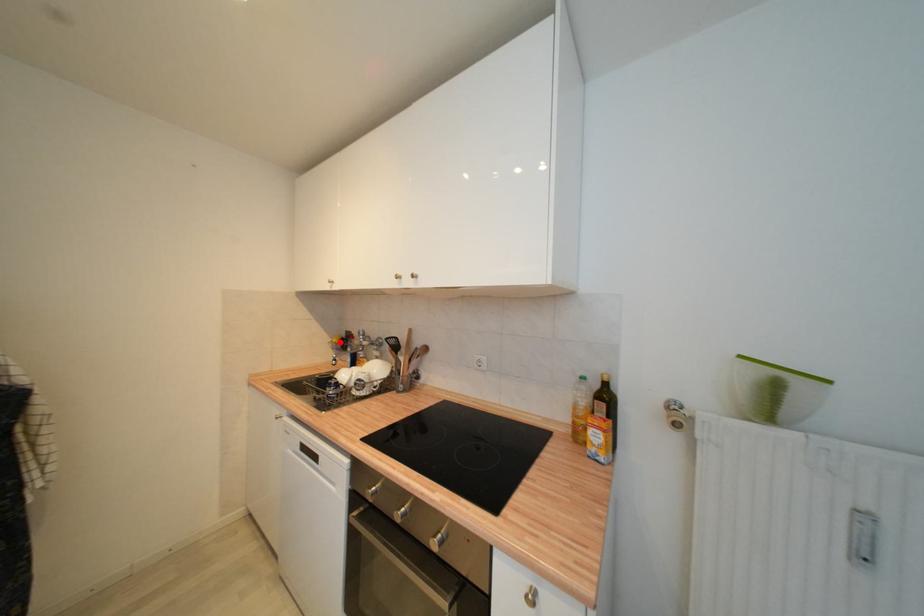
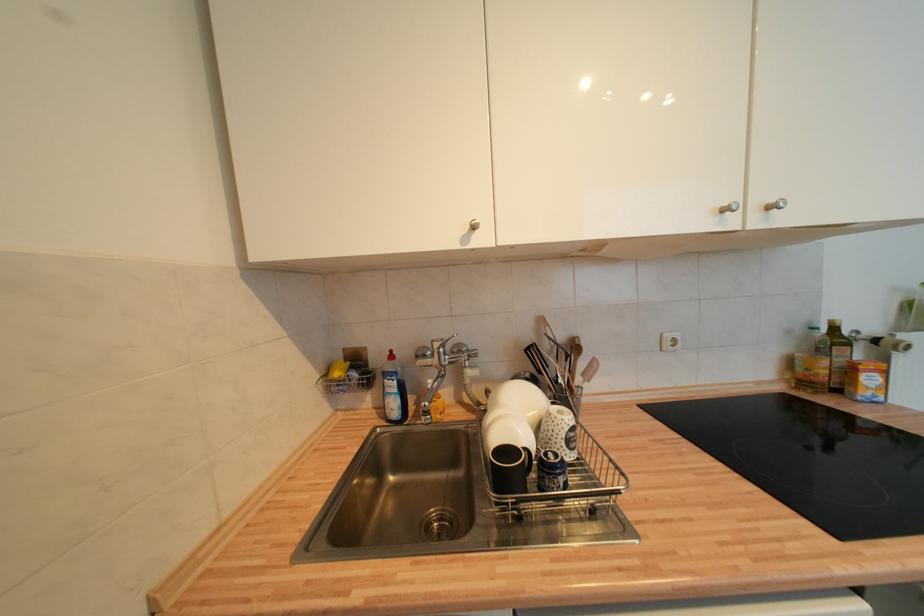
Locate, in the second image, the point that corresponds to the highlighted location in the first image.

(343, 376)